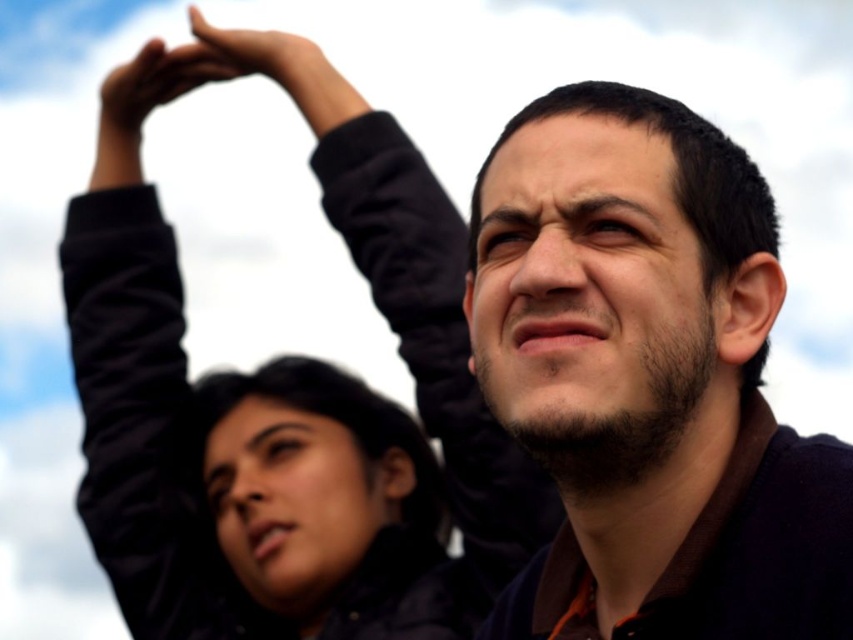
Question: Which point is farther from the camera taking this photo?

Choices:
 (A) (192, 33)
 (B) (151, 234)
 (C) (596, 464)
 (D) (206, 67)

Answer: (B)

Question: Is matte black hand at upper left behind matte black hand at upper center?

Choices:
 (A) yes
 (B) no

Answer: (A)

Question: Which of the following is the closest to the observer?

Choices:
 (A) matte black jacket at upper center
 (B) dark brown sweater at upper right
 (C) black fabric arm at upper left
 (D) matte black hand at upper left

Answer: (B)

Question: Which of the following is the farthest from the observer?

Choices:
 (A) (265, 620)
 (B) (129, 92)
 (C) (746, 202)
 (D) (274, 32)

Answer: (A)

Question: Is dark brown sweater at upper right to the left of matte black jacket at upper center from the viewer's perspective?

Choices:
 (A) yes
 (B) no

Answer: (B)

Question: Is dark brown sweater at upper right to the right of black fabric arm at upper left from the viewer's perspective?

Choices:
 (A) yes
 (B) no

Answer: (A)